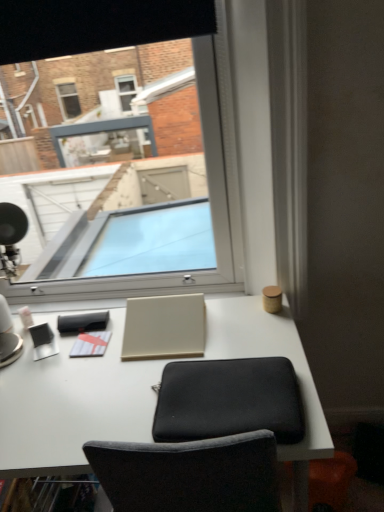
Question: Considering the relative sizes of beige matte laptop at center and black fabric computer chair at center in the image provided, is beige matte laptop at center taller than black fabric computer chair at center?

Choices:
 (A) no
 (B) yes

Answer: (B)

Question: From the image's perspective, is beige matte laptop at center on black fabric computer chair at center?

Choices:
 (A) yes
 (B) no

Answer: (A)

Question: Does beige matte laptop at center come behind black fabric computer chair at center?

Choices:
 (A) yes
 (B) no

Answer: (A)

Question: From a real-world perspective, is beige matte laptop at center under black fabric computer chair at center?

Choices:
 (A) no
 (B) yes

Answer: (A)

Question: Is beige matte laptop at center outside black fabric computer chair at center?

Choices:
 (A) yes
 (B) no

Answer: (A)

Question: Looking at the image, does beige matte laptop at center seem bigger or smaller compared to matte white notepad at center, the 1th notepad in the back-to-front sequence?

Choices:
 (A) big
 (B) small

Answer: (A)

Question: Is beige matte laptop at center to the left or to the right of matte white notepad at center, marked as the 2th notepad in a front-to-back arrangement, in the image?

Choices:
 (A) left
 (B) right

Answer: (B)

Question: In the image, is beige matte laptop at center positioned in front of or behind matte white notepad at center, marked as the 2th notepad in a front-to-back arrangement?

Choices:
 (A) behind
 (B) front

Answer: (B)

Question: Considering the positions of beige matte laptop at center and matte white notepad at center, the 1th notepad in the back-to-front sequence, in the image, is beige matte laptop at center taller or shorter than matte white notepad at center, the 1th notepad in the back-to-front sequence,?

Choices:
 (A) tall
 (B) short

Answer: (A)

Question: Looking at their shapes, would you say transparent glass window at center is wider or thinner than matte white notepad at center, marked as the 1th notepad in a top-to-bottom arrangement?

Choices:
 (A) thin
 (B) wide

Answer: (B)

Question: Would you say transparent glass window at center is to the left or to the right of matte white notepad at center, the 1th notepad in the back-to-front sequence, in the picture?

Choices:
 (A) right
 (B) left

Answer: (A)

Question: Considering the positions of point (205, 278) and point (82, 317), is point (205, 278) closer or farther from the camera than point (82, 317)?

Choices:
 (A) farther
 (B) closer

Answer: (A)

Question: Do you think transparent glass window at center is within matte white notepad at center, marked as the 2th notepad in a front-to-back arrangement, or outside of it?

Choices:
 (A) outside
 (B) inside

Answer: (A)

Question: Considering the positions of white matte notepad at center, which ranks as the 2th notepad in top-to-bottom order, and black fabric computer chair at center in the image, is white matte notepad at center, which ranks as the 2th notepad in top-to-bottom order, bigger or smaller than black fabric computer chair at center?

Choices:
 (A) big
 (B) small

Answer: (B)

Question: From the image's perspective, is white matte notepad at center, which ranks as the 1th notepad in bottom-to-top order, above or below black fabric computer chair at center?

Choices:
 (A) below
 (B) above

Answer: (B)